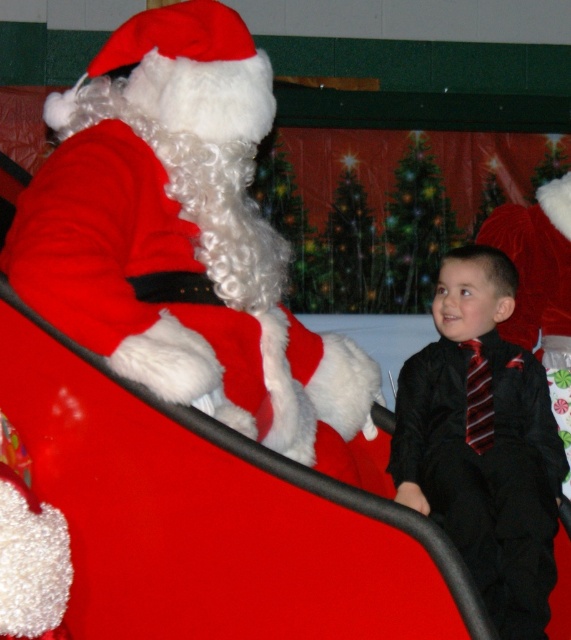
You are a photographer setting up for a Christmas photo shoot. You need to position the velvet red santa at upper left and the black satin suit at right in such a way that they are aligned with the Christmas tree lights in the background. Based on their current positions, which object is closer to the left side of the frame?

The velvet red santa at upper left is positioned on the left side of the black satin suit at right, so the velvet red santa at upper left is closer to the left side of the frame.

You are a photographer trying to capture a photo of the velvet red santa at upper left and the black satin suit at right. The camera you are using has a maximum focus range of 25 inches. Can you capture both subjects in focus without moving the camera?

The velvet red santa at upper left is 28.95 inches away from the black satin suit at right, which exceeds the camera maximum focus range of 25 inches. Therefore, you cannot capture both subjects in focus without moving the camera.